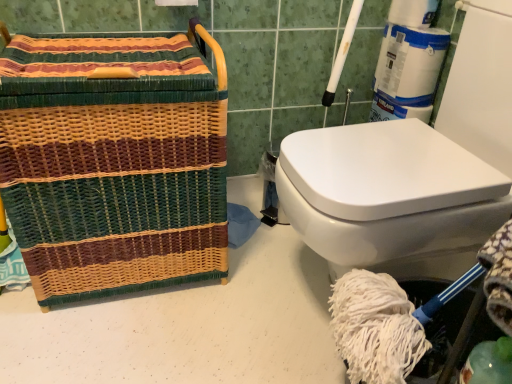
Question: From a real-world perspective, is teal glass at lower right positioned above or below woven multicolored basket at left?

Choices:
 (A) below
 (B) above

Answer: (A)

Question: Is point (499, 367) closer or farther from the camera than point (11, 66)?

Choices:
 (A) closer
 (B) farther

Answer: (A)

Question: From the image's perspective, is teal glass at lower right located above or below woven multicolored basket at left?

Choices:
 (A) above
 (B) below

Answer: (B)

Question: From a real-world perspective, relative to teal glass at lower right, is woven multicolored basket at left vertically above or below?

Choices:
 (A) above
 (B) below

Answer: (A)

Question: Would you say woven multicolored basket at left is to the left or to the right of teal glass at lower right in the picture?

Choices:
 (A) right
 (B) left

Answer: (B)

Question: Is woven multicolored basket at left wider or thinner than teal glass at lower right?

Choices:
 (A) wide
 (B) thin

Answer: (A)

Question: From the image's perspective, is woven multicolored basket at left above or below teal glass at lower right?

Choices:
 (A) above
 (B) below

Answer: (A)